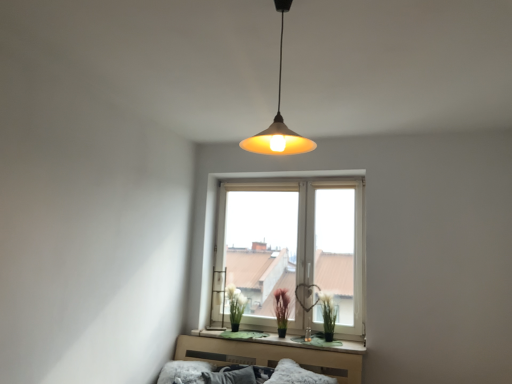
Question: Is fluffy white pillow at lower center, the second pillow when ordered from right to left, taller or shorter than purple matte plant at center, arranged as the first plant when viewed from the left?

Choices:
 (A) tall
 (B) short

Answer: (B)

Question: Considering the positions of fluffy white pillow at lower center, the 1th pillow from the left, and purple matte plant at center, placed as the second plant when sorted from right to left, in the image, is fluffy white pillow at lower center, the 1th pillow from the left, wider or thinner than purple matte plant at center, placed as the second plant when sorted from right to left,?

Choices:
 (A) wide
 (B) thin

Answer: (A)

Question: Which of these objects is positioned closest to the green matte plant at window, positioned as the 1th plant in right-to-left order?

Choices:
 (A) green matte window sill at center
 (B) white matte plant at center
 (C) matte yellow plastic lampshade at upper center
 (D) fluffy white pillow at lower center, the second pillow when ordered from right to left
 (E) purple matte plant at center, placed as the second plant when sorted from right to left

Answer: (A)

Question: Considering the real-world distances, which object is closest to the white fluffy pillow at lower center, which is the 2th pillow from left to right?

Choices:
 (A) matte yellow plastic lampshade at upper center
 (B) white matte plant at center
 (C) white plastic window at center
 (D) purple matte plant at center, placed as the second plant when sorted from right to left
 (E) green matte plant at window, positioned as the 1th plant in right-to-left order

Answer: (E)